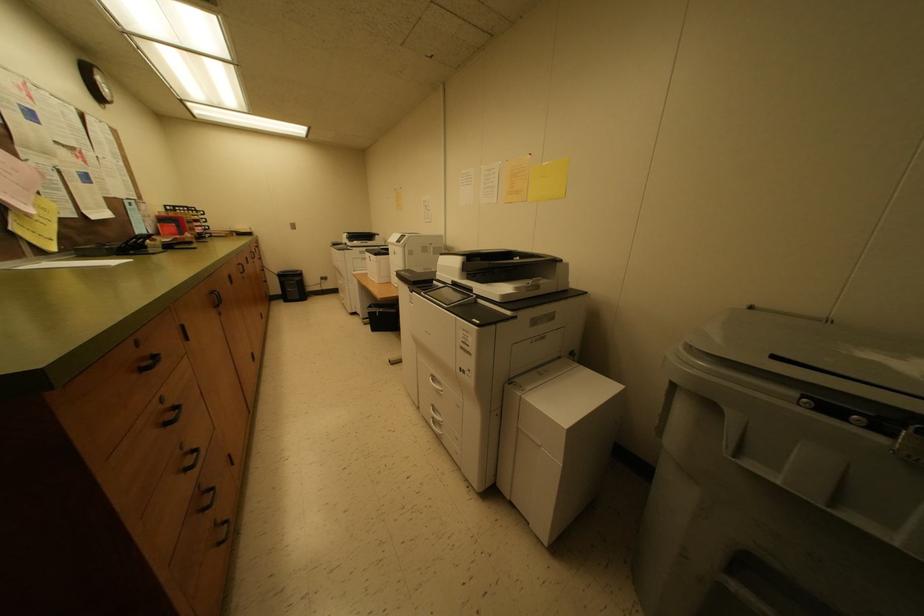
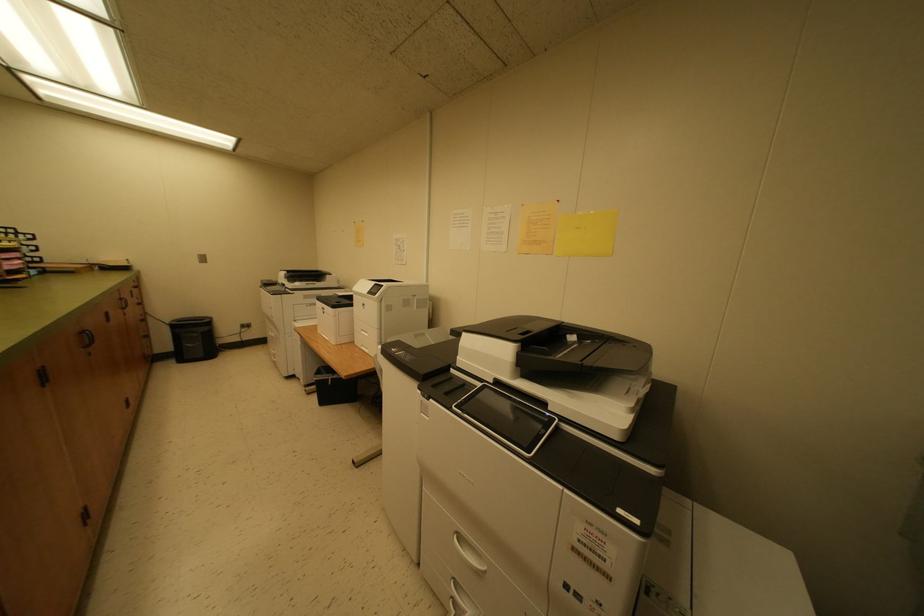
In a continuous first-person perspective shot, in which direction is the camera moving?

The movement direction of the cameraman is left, forward.